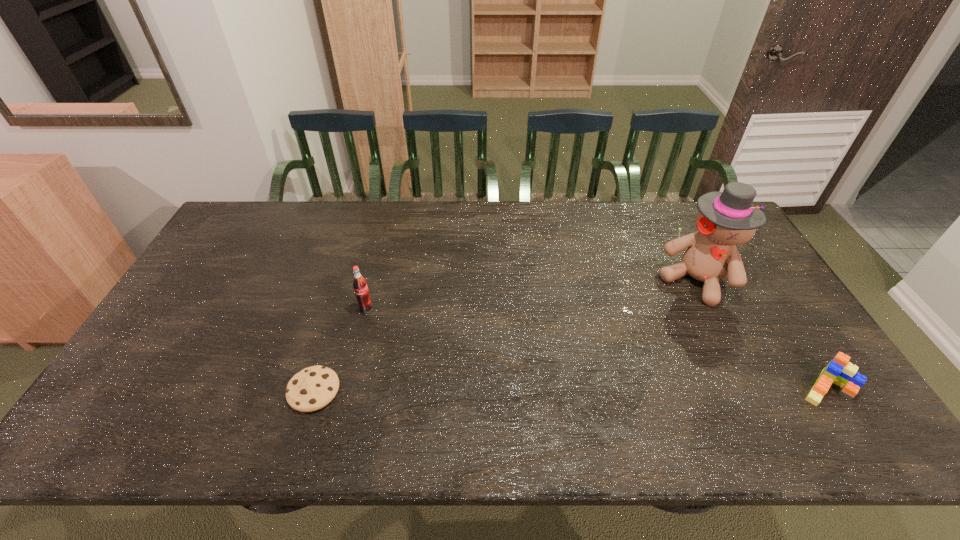
What are the coordinates of `empty space between the tallest object and the Lego` in the screenshot? It's located at (761, 334).

The image size is (960, 540). I want to click on empty space between the rag_doll and the second tallest object, so click(531, 295).

I want to click on free space between the cookie and the second shortest object, so click(570, 389).

Find the location of a particular element. unoccupied area between the Lego and the rag_doll is located at coordinates (761, 334).

Identify which object is located as the nearest to the tallest object. Please provide its 2D coordinates. Your answer should be formatted as a tuple, i.e. [(x, y)], where the tuple contains the x and y coordinates of a point satisfying the conditions above.

[(840, 371)]

Where is `the second closest object to the soda bottle`? The width and height of the screenshot is (960, 540). the second closest object to the soda bottle is located at coordinates (725, 219).

You are a GUI agent. You are given a task and a screenshot of the screen. Output one action in this format:
    pyautogui.click(x=<x>, y=<y>)
    Task: Click on the free point that satisfies the following two spatial constraints: 1. on the front side of the rag_doll; 2. on the right side of the Lego
    Image resolution: width=960 pixels, height=540 pixels.
    Given the screenshot: What is the action you would take?
    pyautogui.click(x=749, y=387)